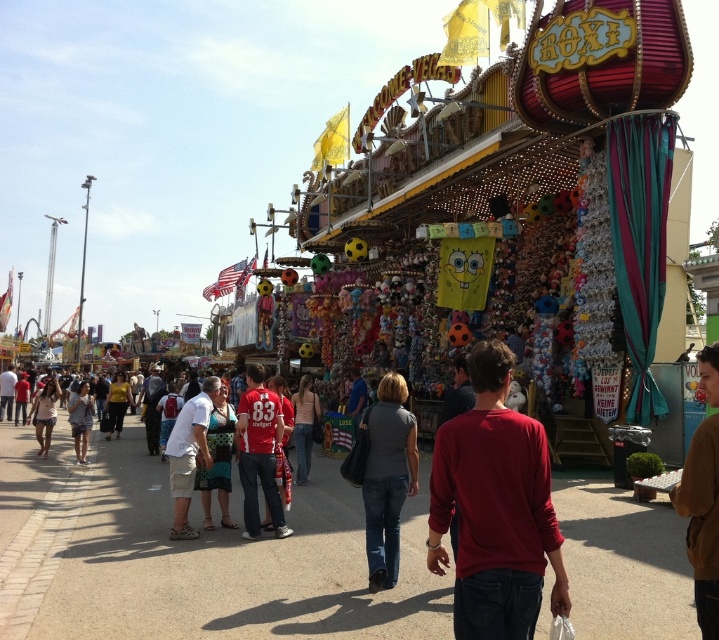
Question: Does matte red jersey at center appear over light brown denim shorts at lower left?

Choices:
 (A) no
 (B) yes

Answer: (B)

Question: Which of the following is the closest to the observer?

Choices:
 (A) gray matte shirt at center
 (B) brown fuzzy sweater at lower right
 (C) light brown denim shorts at lower left
 (D) white cotton shirt at center

Answer: (B)

Question: Which object appears closest to the camera in this image?

Choices:
 (A) red cotton shirt at center
 (B) brown fuzzy sweater at lower right
 (C) matte red jersey at center
 (D) gray matte shirt at center

Answer: (B)

Question: Which object appears closest to the camera in this image?

Choices:
 (A) light brown denim shorts at lower left
 (B) matte red jersey at center

Answer: (B)

Question: Does gray matte shirt at center appear on the left side of white cotton shirt at center?

Choices:
 (A) yes
 (B) no

Answer: (B)

Question: Is gray matte shirt at center wider than light brown denim shorts at lower left?

Choices:
 (A) no
 (B) yes

Answer: (A)